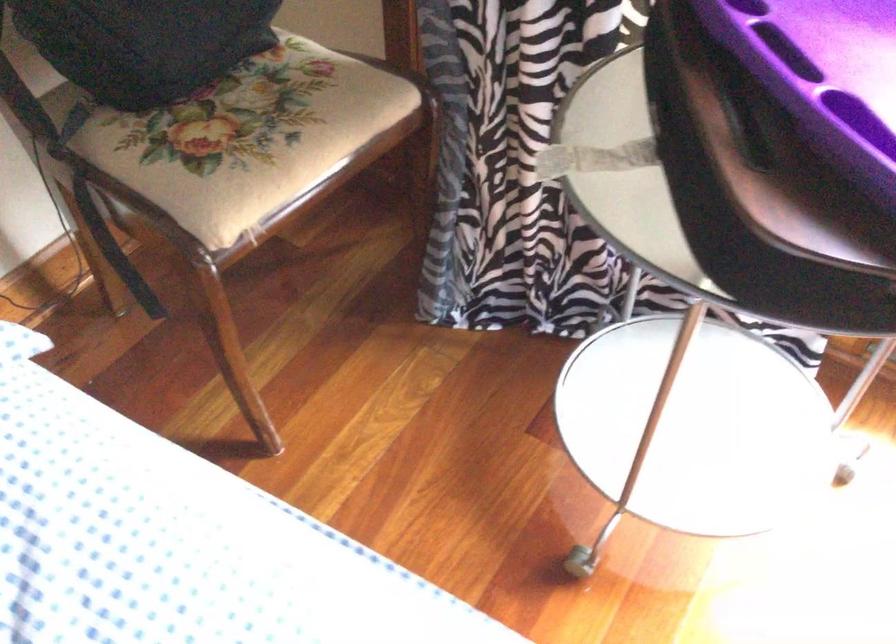
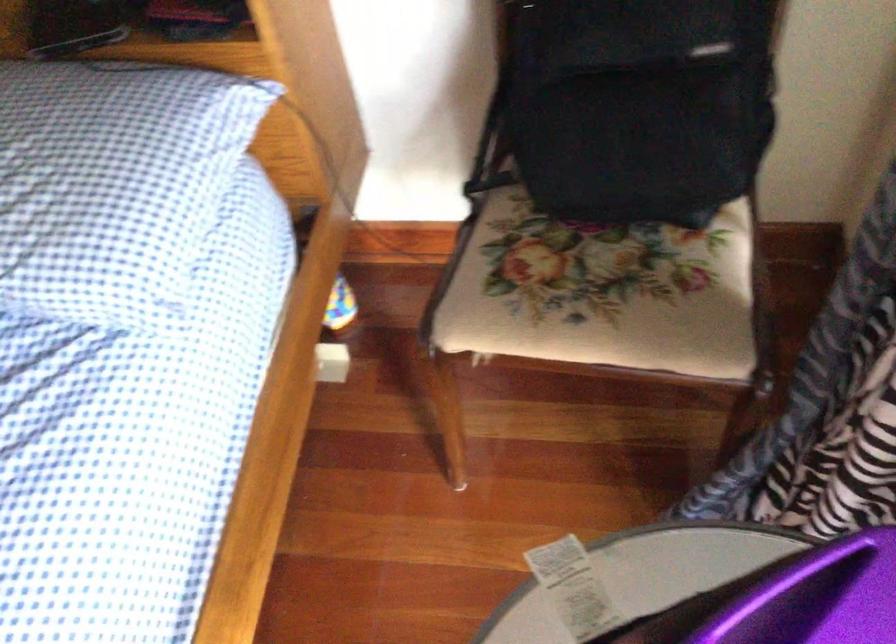
Where in the second image is the point corresponding to pixel 281 111 from the first image?

(599, 292)